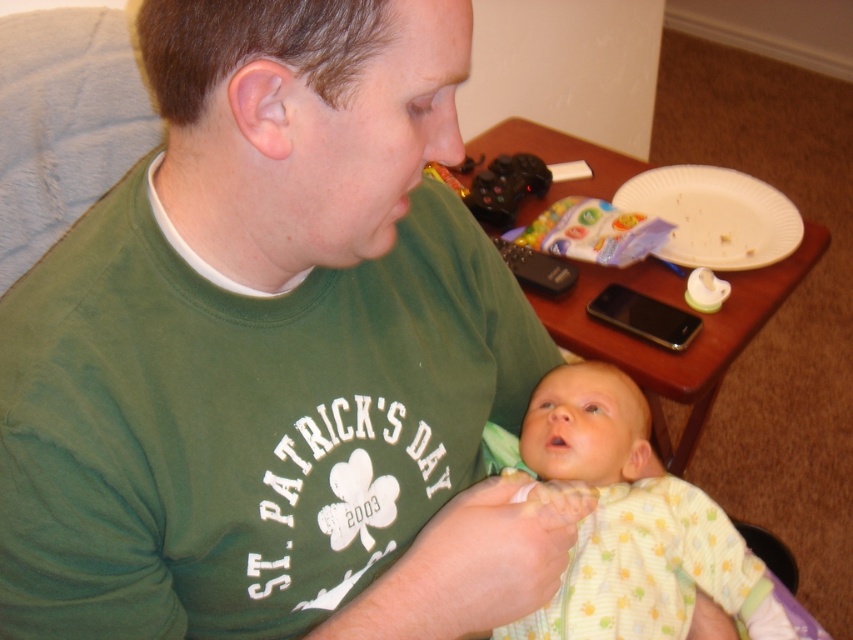
Question: Which object is positioned closest to the light yellow knit onesie at center?

Choices:
 (A) black matte game controller at upper center
 (B) white paper plate at upper right

Answer: (B)

Question: Does light yellow knit onesie at center appear over white paper plate at upper right?

Choices:
 (A) no
 (B) yes

Answer: (A)

Question: Is light yellow knit onesie at center wider than black matte game controller at upper center?

Choices:
 (A) yes
 (B) no

Answer: (A)

Question: Considering the real-world distances, which object is closest to the white paper plate at upper right?

Choices:
 (A) black matte game controller at upper center
 (B) light yellow knit onesie at center

Answer: (A)

Question: Which point is farther to the camera?

Choices:
 (A) (795, 214)
 (B) (514, 172)

Answer: (B)

Question: Is white paper plate at upper right positioned in front of black matte game controller at upper center?

Choices:
 (A) no
 (B) yes

Answer: (B)